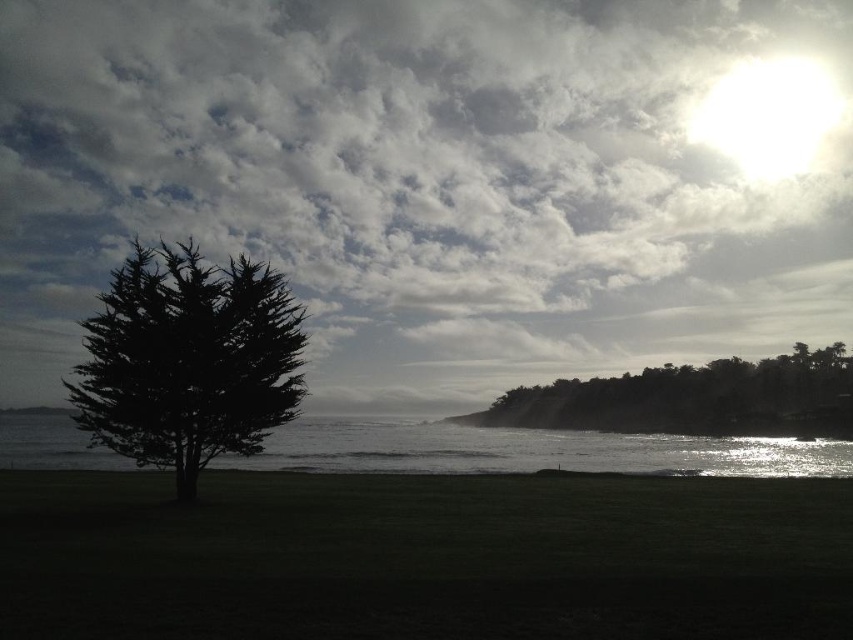
Is cloudy sky at upper center below green grassy at center?

No, cloudy sky at upper center is not below green grassy at center.

Who is higher up, cloudy sky at upper center or green grassy at center?

Positioned higher is cloudy sky at upper center.

Between point (583, 134) and point (9, 618), which one is positioned in front?

Point (9, 618)

Where is `cloudy sky at upper center`? Image resolution: width=853 pixels, height=640 pixels. cloudy sky at upper center is located at coordinates (421, 180).

Is black matte tree at left smaller than glistening silver water at center?

Correct, black matte tree at left occupies less space than glistening silver water at center.

Who is shorter, black matte tree at left or glistening silver water at center?

glistening silver water at center

In order to click on black matte tree at left in this screenshot , I will do `click(189, 360)`.

Does green grassy at center come in front of glistening silver water at center?

Yes, it is.

Is point (694, 556) behind point (831, 461)?

No, it is not.

Does point (520, 592) come closer to viewer compared to point (534, 452)?

That is True.

This screenshot has height=640, width=853. Find the location of `green grassy at center`. green grassy at center is located at coordinates (422, 557).